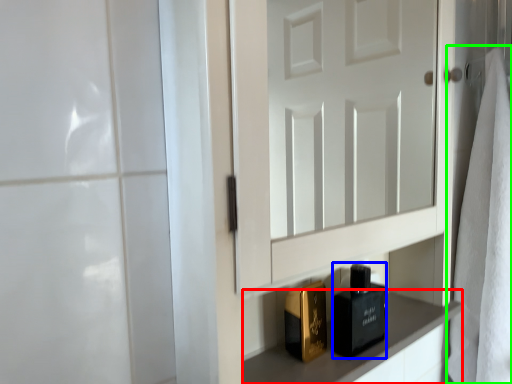
Question: Considering the real-world distances, which object is farthest from cabinetry (highlighted by a red box)? perfume (highlighted by a blue box) or bath towel (highlighted by a green box)?

Choices:
 (A) perfume
 (B) bath towel

Answer: (B)